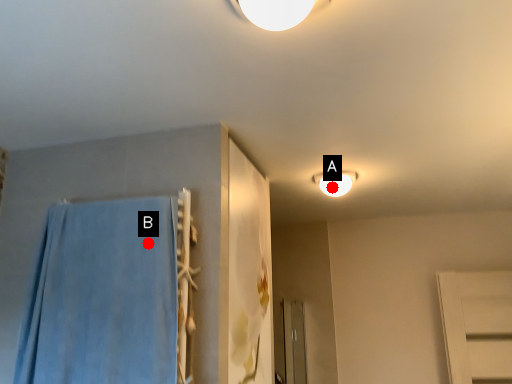
Question: Two points are circled on the image, labeled by A and B beside each circle. Which of the following is the closest to the observer?

Choices:
 (A) A is closer
 (B) B is closer

Answer: (B)